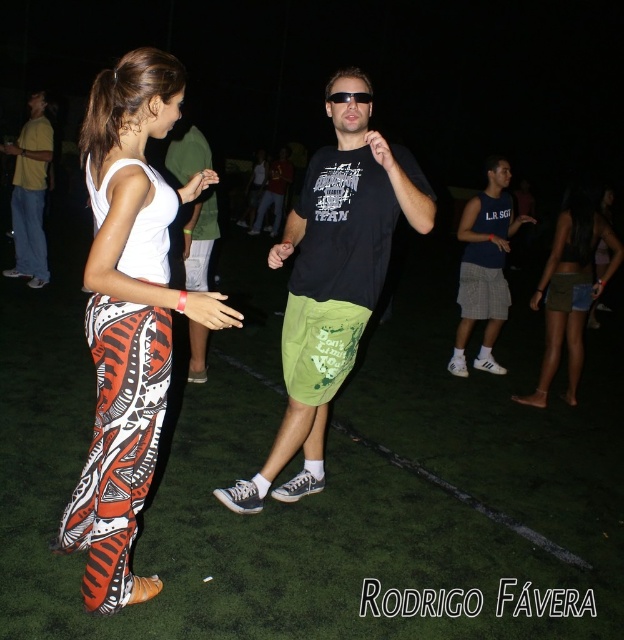
You are standing in the night gathering and want to place your black plastic goggles at center on the green artificial turf at center. Can you place them directly on top of the turf?

The green artificial turf at center is closer to the viewer than the black plastic goggles at center, so you can place the black plastic goggles at center directly on top of the green artificial turf at center since the goggles are positioned further away but still on the same plane.

You are standing at the position of point (x=358, y=145) and want to walk towards the position of point (x=175, y=620). Which direction should you face to move directly towards it?

You should face towards the direction of point (x=175, y=620), which is in front of point (x=358, y=145), so you need to face towards the lower right direction to move directly towards it.

You are a person who needs to place a 3.0 meter long ladder between the green artificial turf at center and the black plastic goggles at center. Is there enough space to place the ladder horizontally between them?

The distance between the green artificial turf at center and the black plastic goggles at center is 2.60 meters. Since the ladder is 3.0 meters long, which is longer than the available space, the ladder cannot be placed horizontally between them.